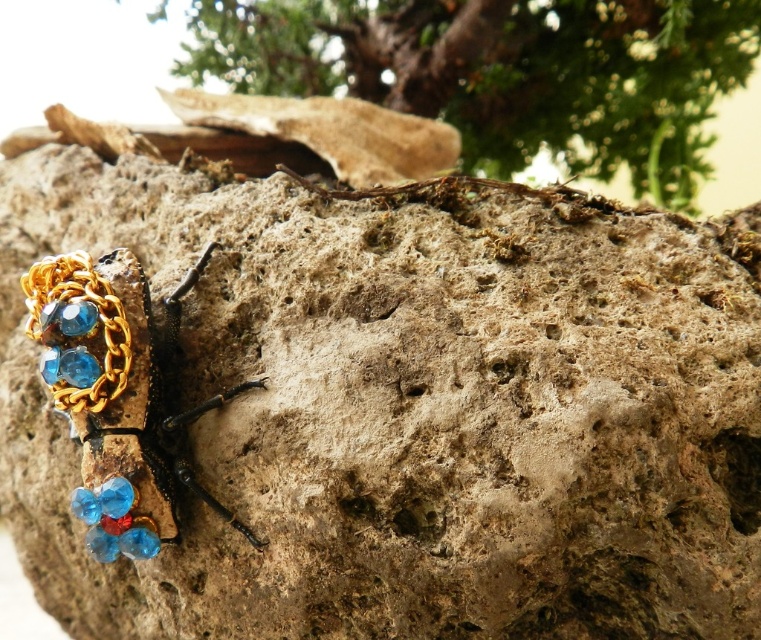
Question: Does green leafy tree at upper center have a greater width compared to gold chain and gemstone beetle at left?

Choices:
 (A) yes
 (B) no

Answer: (A)

Question: From the image, what is the correct spatial relationship of green leafy tree at upper center in relation to gold chain and gemstone beetle at left?

Choices:
 (A) left
 (B) right

Answer: (B)

Question: Which object appears farthest from the camera in this image?

Choices:
 (A) green leafy tree at upper center
 (B) gold chain and gemstone beetle at left

Answer: (A)

Question: Which point is closer to the camera?

Choices:
 (A) gold chain and gemstone beetle at left
 (B) green leafy tree at upper center

Answer: (A)

Question: Is green leafy tree at upper center further to the viewer compared to gold chain and gemstone beetle at left?

Choices:
 (A) yes
 (B) no

Answer: (A)